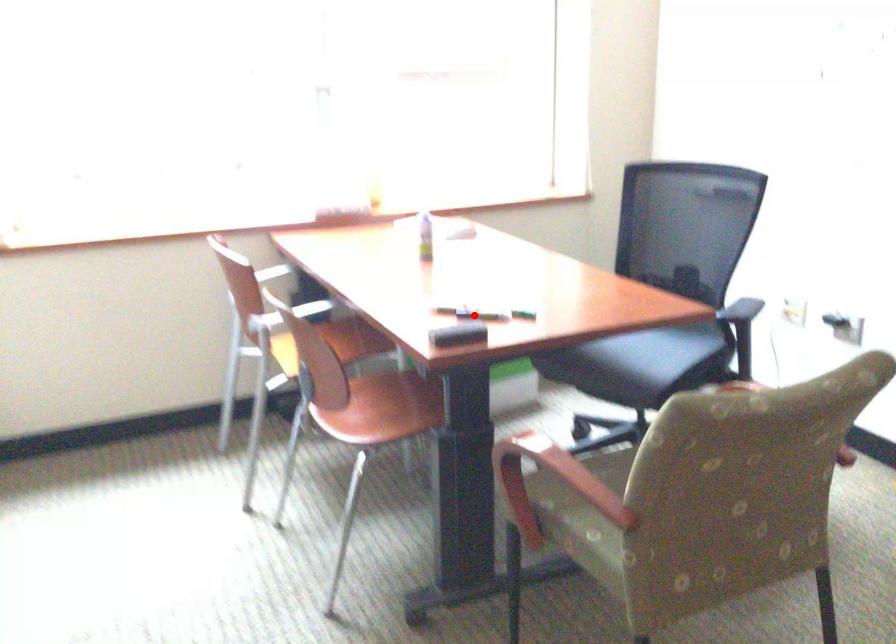
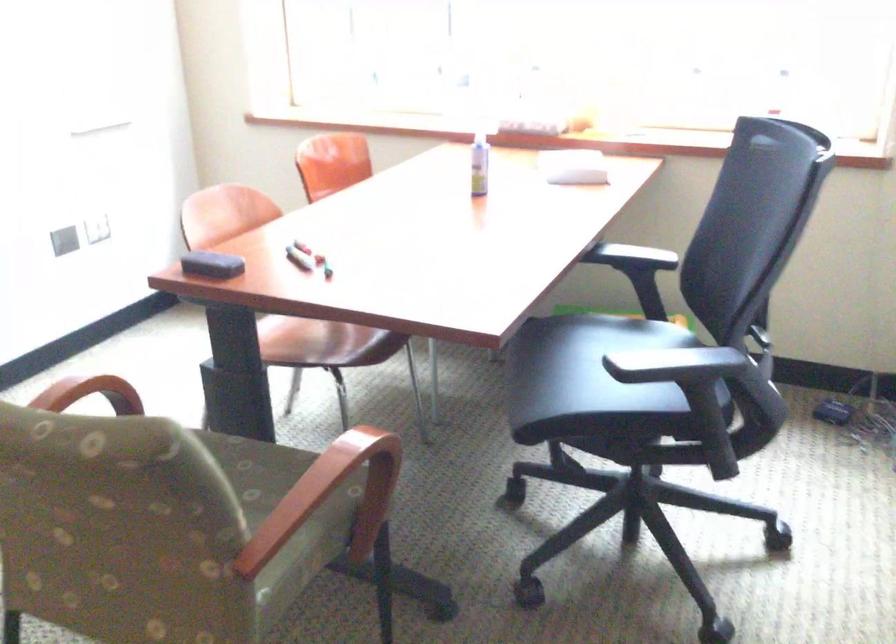
Find the pixel in the second image that matches the highlighted location in the first image.

(299, 258)